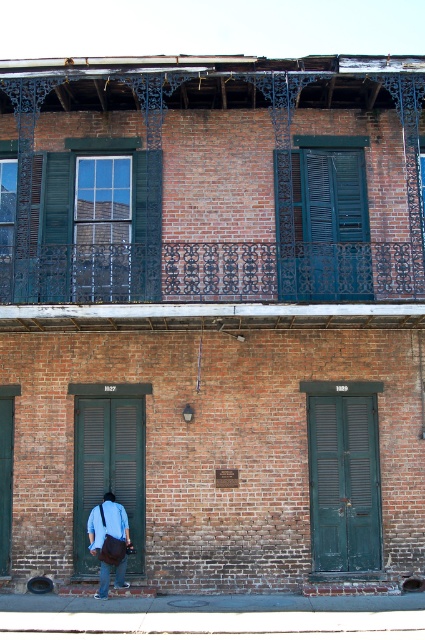
You are a window cleaner with a ladder that can reach up to 2 meters. You need to clean the dark teal wrought iron balcony at upper center and the white matte dress shirt at lower left. Which object can you reach with your ladder?

The dark teal wrought iron balcony at upper center has a greater height compared to the white matte dress shirt at lower left. Since the ladder can reach up to 2 meters, you can clean the white matte dress shirt at lower left but cannot reach the dark teal wrought iron balcony at upper center.

You are a delivery person trying to deliver a package to the address 1027. You are standing in front of the building and see the green wrought iron balcony at upper center and the white matte dress shirt at lower left. Which object is wider?

The green wrought iron balcony at upper center is wider than the white matte dress shirt at lower left.

You are a delivery person trying to deliver a package to the address 1027. You see the dark teal wrought iron balcony at upper center and the white matte dress shirt at lower left. Which object is directly above the apartment with the correct address?

The dark teal wrought iron balcony at upper center is positioned over the white matte dress shirt at lower left, so the apartment with address 1027 is likely under the dark teal wrought iron balcony at upper center.